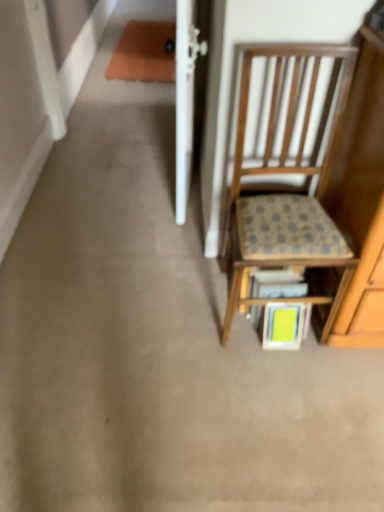
Describe the element at coordinates (303, 296) in the screenshot. The image size is (384, 512). I see `wooden textured shelf at center` at that location.

This screenshot has width=384, height=512. Describe the element at coordinates (283, 325) in the screenshot. I see `green matte book at lower center` at that location.

I want to click on green matte book at lower center, so click(x=283, y=325).

Identify the location of wooden textured shelf at center. (303, 296).

Image resolution: width=384 pixels, height=512 pixels. Identify the location of chair in front of the wooden textured shelf at center. (289, 187).

Which point is more distant from viewer, (x=225, y=322) or (x=322, y=274)?

The point (x=225, y=322) is more distant.

Is wooden textured shelf at center smaller than wooden chair with cushion at right?

Yes, wooden textured shelf at center is smaller than wooden chair with cushion at right.

Considering the positions of objects wooden textured shelf at center and wooden chair with cushion at right in the image provided, who is in front, wooden textured shelf at center or wooden chair with cushion at right?

wooden chair with cushion at right.

Which object is positioned more to the right, wooden chair with cushion at right or green matte book at lower center?

green matte book at lower center.

Is green matte book at lower center a part of wooden chair with cushion at right?

Yes, wooden chair with cushion at right is surrounding green matte book at lower center.

Considering the sizes of objects wooden chair with cushion at right and green matte book at lower center in the image provided, who is wider, wooden chair with cushion at right or green matte book at lower center?

wooden chair with cushion at right is wider.

Is wooden chair with cushion at right taller or shorter than green matte book at lower center?

Considering their sizes, wooden chair with cushion at right has more height than green matte book at lower center.

Image resolution: width=384 pixels, height=512 pixels. I want to click on book located on the right of wooden chair with cushion at right, so click(x=283, y=325).

Is green matte book at lower center aimed at wooden chair with cushion at right?

Yes, green matte book at lower center is oriented towards wooden chair with cushion at right.

Who is shorter, green matte book at lower center or wooden chair with cushion at right?

green matte book at lower center.

In the scene shown: Is wooden chair with cushion at right turned away from wooden textured shelf at center?

Yes, wooden chair with cushion at right is facing away from wooden textured shelf at center.

Who is shorter, wooden chair with cushion at right or wooden textured shelf at center?

Standing shorter between the two is wooden textured shelf at center.

Looking at this image, from a real-world perspective, between wooden chair with cushion at right and wooden textured shelf at center, who is vertically higher?

From a 3D spatial view, wooden chair with cushion at right is above.

Is wooden chair with cushion at right not near wooden textured shelf at center?

No, wooden chair with cushion at right is not far from wooden textured shelf at center.

Is green matte book at lower center far away from wooden textured shelf at center?

Actually, green matte book at lower center and wooden textured shelf at center are a little close together.

Can you confirm if green matte book at lower center is thinner than wooden textured shelf at center?

Indeed, green matte book at lower center has a lesser width compared to wooden textured shelf at center.

From the image's perspective, is green matte book at lower center below wooden textured shelf at center?

Yes.

Is green matte book at lower center facing away from wooden textured shelf at center?

Yes, green matte book at lower center is facing away from wooden textured shelf at center.

Is wooden textured shelf at center directly adjacent to green matte book at lower center?

No, wooden textured shelf at center is not in contact with green matte book at lower center.

Which object is wider, wooden textured shelf at center or green matte book at lower center?

Wider between the two is wooden textured shelf at center.

From their relative heights in the image, would you say wooden textured shelf at center is taller or shorter than green matte book at lower center?

Considering their sizes, wooden textured shelf at center has more height than green matte book at lower center.

Which is correct: wooden textured shelf at center is inside green matte book at lower center, or outside of it?

wooden textured shelf at center is not inside green matte book at lower center, it's outside.

Locate an element on the screen. chair in front of the wooden textured shelf at center is located at coordinates (289, 187).

At what (x,y) coordinates should I click in order to perform the action: click on chair above the green matte book at lower center (from the image's perspective). Please return your answer as a coordinate pair (x, y). Looking at the image, I should click on (289, 187).

From the image, which object appears to be farther from wooden chair with cushion at right, wooden textured shelf at center or green matte book at lower center?

The object further to wooden chair with cushion at right is green matte book at lower center.

Which object lies nearer to the anchor point green matte book at lower center, wooden chair with cushion at right or wooden textured shelf at center?

wooden textured shelf at center lies closer to green matte book at lower center than the other object.

Looking at the image, which one is located closer to green matte book at lower center, wooden textured shelf at center or wooden chair with cushion at right?

The object closer to green matte book at lower center is wooden textured shelf at center.

Based on their spatial positions, is wooden chair with cushion at right or green matte book at lower center closer to wooden textured shelf at center?

Among the two, green matte book at lower center is located nearer to wooden textured shelf at center.

From the image, which object appears to be farther from wooden chair with cushion at right, green matte book at lower center or wooden textured shelf at center?

Based on the image, green matte book at lower center appears to be further to wooden chair with cushion at right.

When comparing their distances from wooden textured shelf at center, does green matte book at lower center or wooden chair with cushion at right seem closer?

Based on the image, green matte book at lower center appears to be nearer to wooden textured shelf at center.

The image size is (384, 512). What are the coordinates of `shelf located between wooden chair with cushion at right and green matte book at lower center in the depth direction` in the screenshot? It's located at (303, 296).